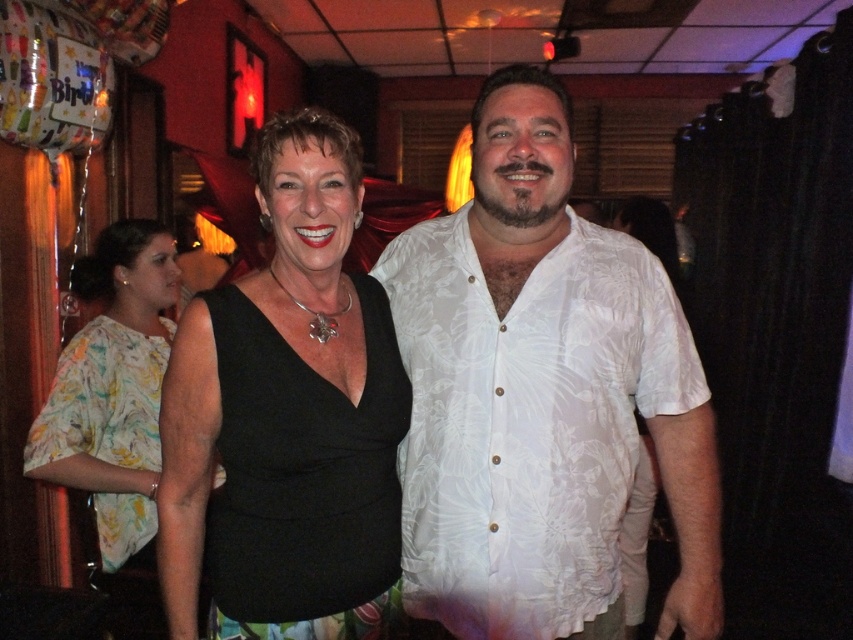
Question: Among these objects, which one is nearest to the camera?

Choices:
 (A) printed fabric dress at center
 (B) black matte dress at center

Answer: (B)

Question: Does white floral shirt at center lie in front of black matte dress at center?

Choices:
 (A) yes
 (B) no

Answer: (B)

Question: Which point is closer to the camera taking this photo?

Choices:
 (A) (560, 628)
 (B) (93, 492)
 (C) (265, 369)

Answer: (C)

Question: Which point is farther to the camera?

Choices:
 (A) (383, 308)
 (B) (502, 80)
 (C) (155, 468)

Answer: (C)

Question: Does white floral shirt at center have a lesser width compared to printed fabric dress at center?

Choices:
 (A) no
 (B) yes

Answer: (A)

Question: Is white floral shirt at center wider than printed fabric dress at center?

Choices:
 (A) no
 (B) yes

Answer: (B)